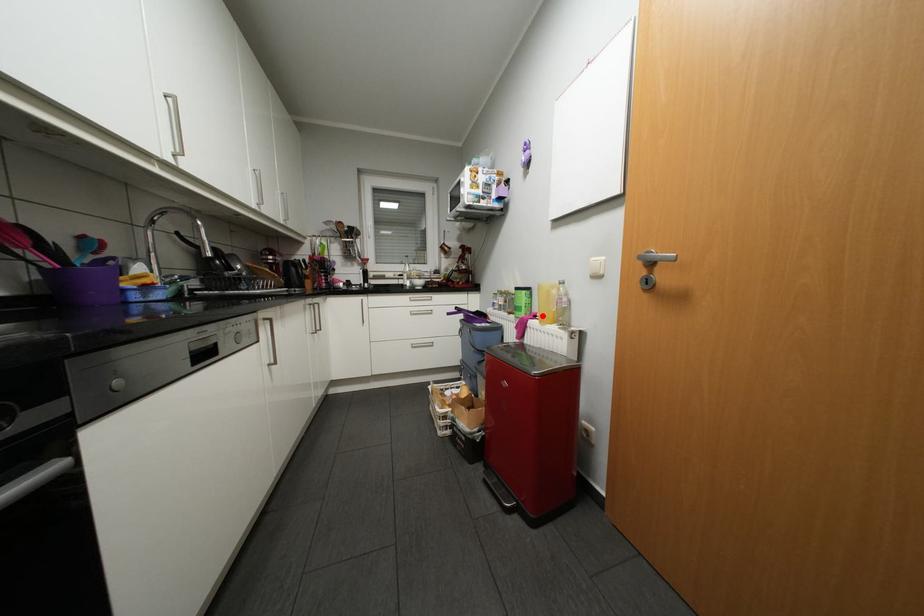
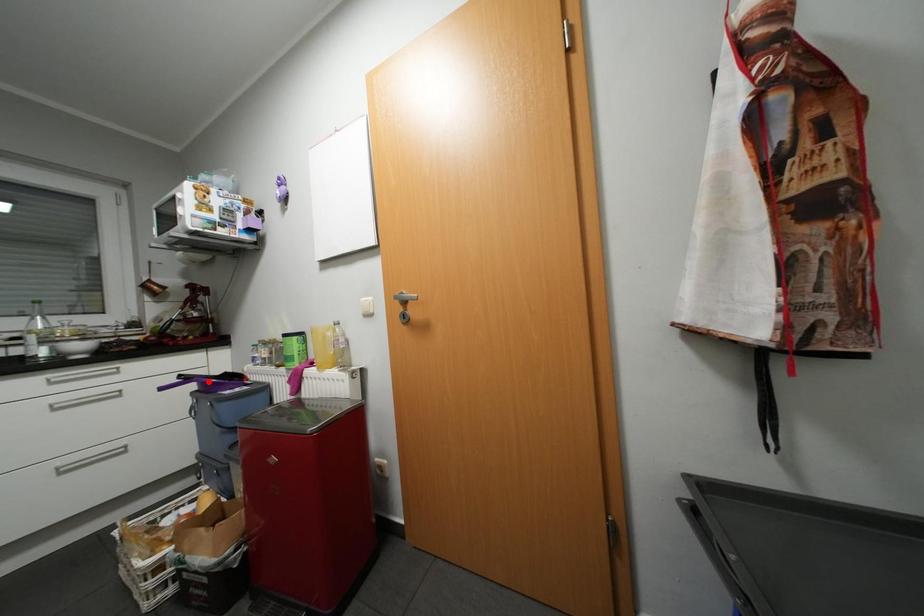
I am providing you with two images of the same scene from different viewpoints. A red point is marked on the first image and another point is marked on the second image. Are the points marked in image1 and image2 representing the same 3D position?

No